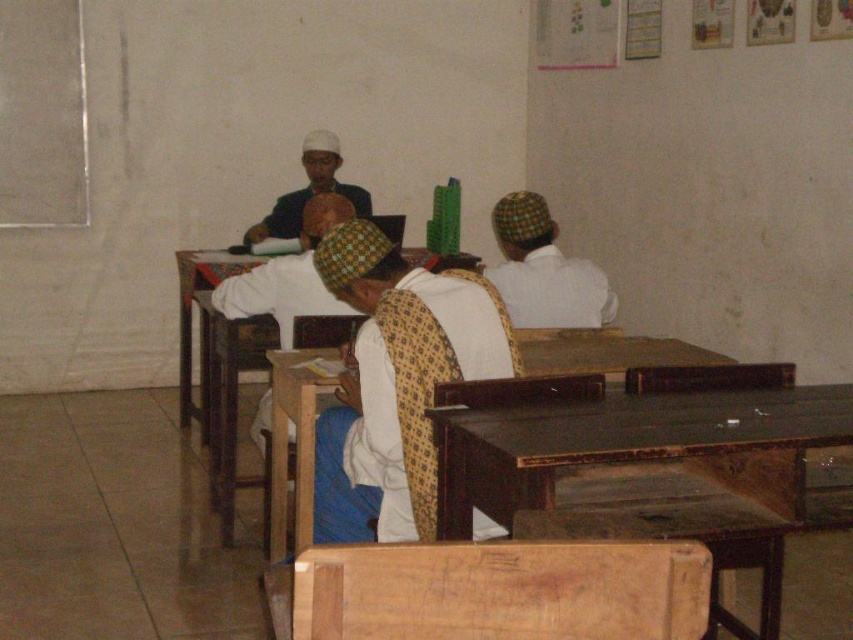
Based on the photo, is dark brown wooden table at center smaller than white cloth at upper center?

A: Incorrect, dark brown wooden table at center is not smaller in size than white cloth at upper center.

Does point (583, 449) come behind point (558, 275)?

No, (583, 449) is in front of (558, 275).

The height and width of the screenshot is (640, 853). Identify the location of dark brown wooden table at center. (634, 445).

The image size is (853, 640). Describe the element at coordinates (543, 269) in the screenshot. I see `white cloth at upper center` at that location.

Does white cloth at upper center appear on the right side of matte black shirt at center?

Correct, you'll find white cloth at upper center to the right of matte black shirt at center.

The image size is (853, 640). What do you see at coordinates (543, 269) in the screenshot? I see `white cloth at upper center` at bounding box center [543, 269].

The width and height of the screenshot is (853, 640). What are the coordinates of `white cloth at upper center` in the screenshot? It's located at (543, 269).

Is point (369, 426) farther from viewer compared to point (287, 230)?

No, it is in front of (287, 230).

What do you see at coordinates (395, 384) in the screenshot? This screenshot has height=640, width=853. I see `white cotton shirt at center` at bounding box center [395, 384].

Locate an element on the screen. white cotton shirt at center is located at coordinates (395, 384).